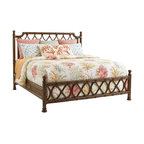
The height and width of the screenshot is (144, 144). What are the coordinates of `bed post` in the screenshot? It's located at (14, 31), (80, 31), (130, 71), (44, 78).